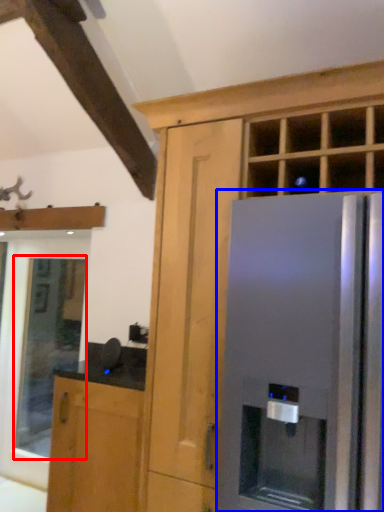
Question: Which object appears farthest to the camera in this image, window (highlighted by a red box) or refrigerator (highlighted by a blue box)?

Choices:
 (A) window
 (B) refrigerator

Answer: (A)